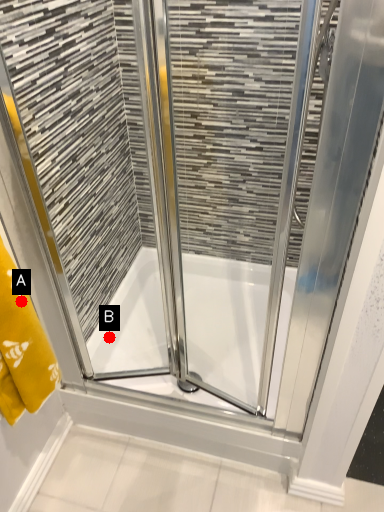
Question: Two points are circled on the image, labeled by A and B beside each circle. Which point appears closest to the camera in this image?

Choices:
 (A) A is closer
 (B) B is closer

Answer: (A)